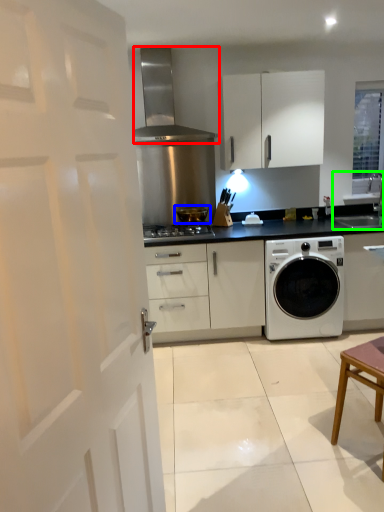
Question: Based on their relative distances, which object is farther from home appliance (highlighted by a red box)? Choose from appliance (highlighted by a blue box) and sink (highlighted by a green box).

Choices:
 (A) appliance
 (B) sink

Answer: (B)